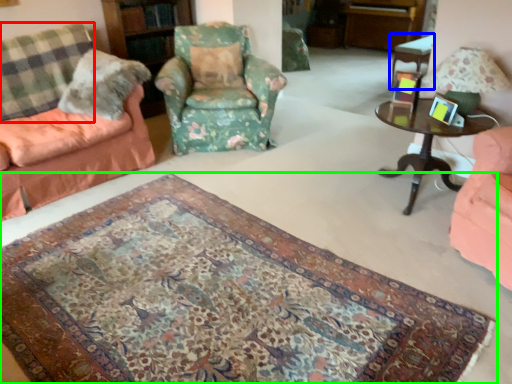
Question: Which object is positioned farthest from plaid (highlighted by a red box)? Select from table (highlighted by a blue box) and mat (highlighted by a green box).

Choices:
 (A) table
 (B) mat

Answer: (A)